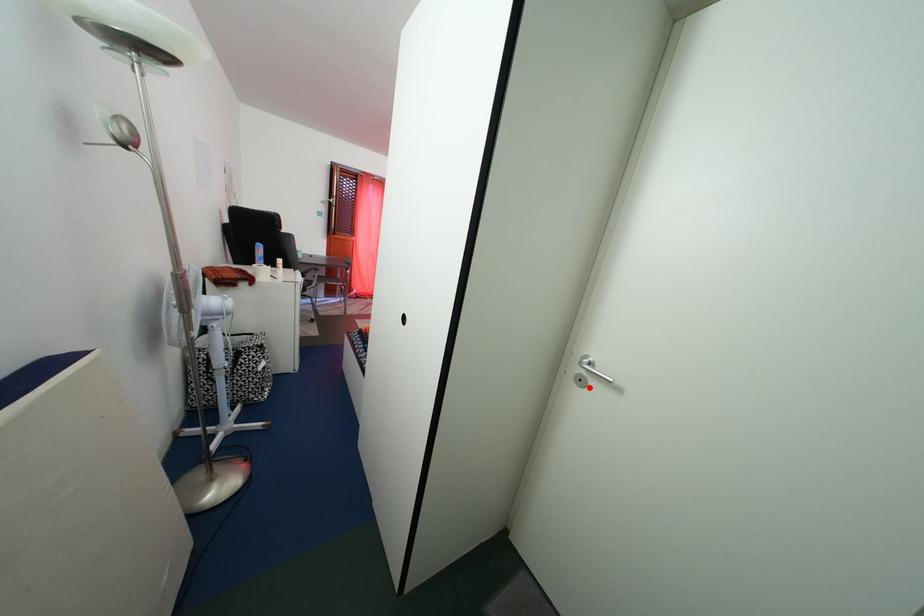
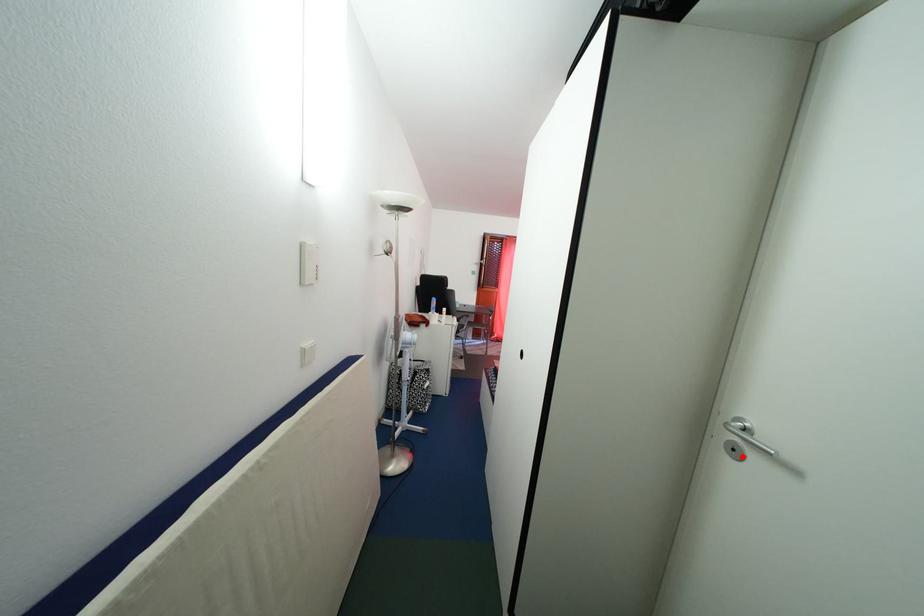
I am providing you with two images of the same scene from different viewpoints. A red point is marked on the first image and another point is marked on the second image. Do the highlighted points in image1 and image2 indicate the same real-world spot?

Yes